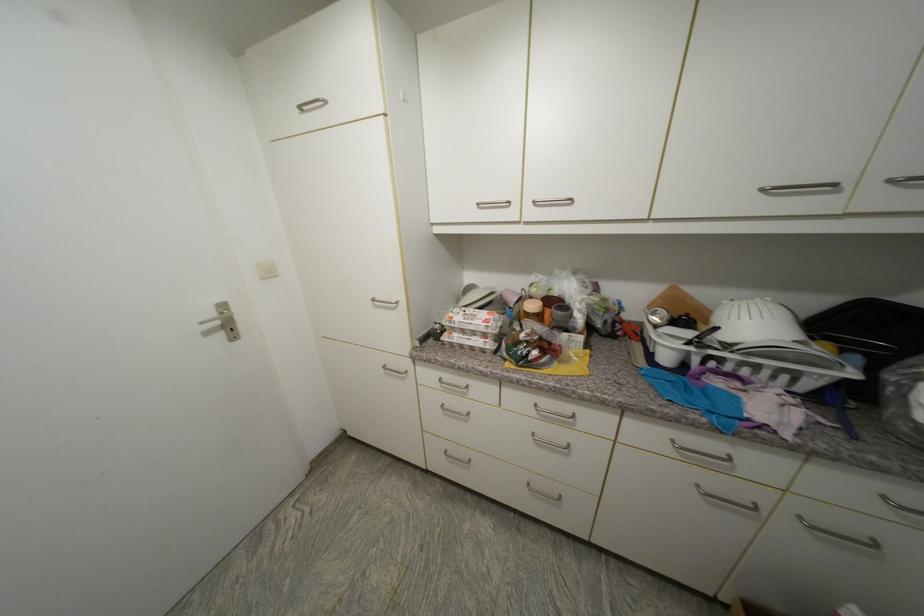
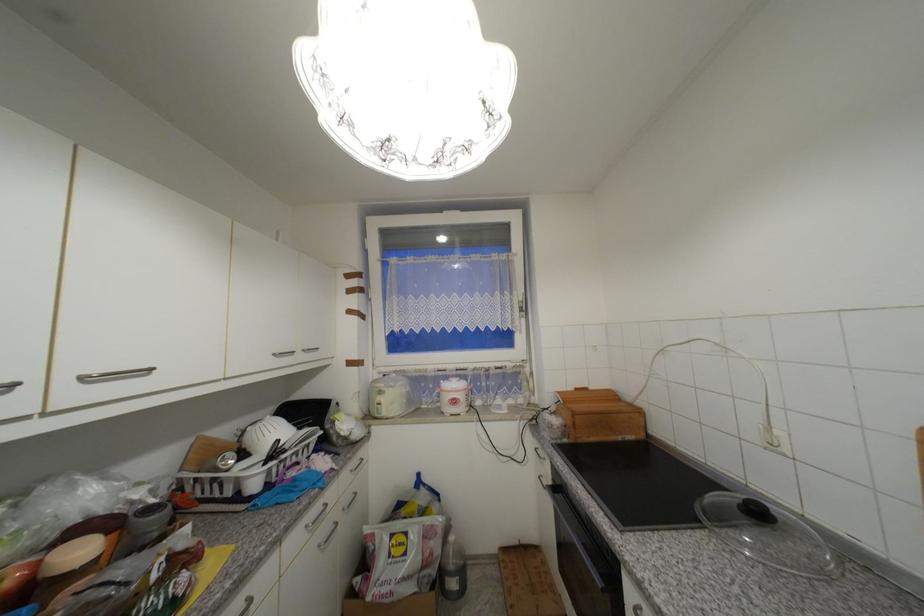
Find the pixel in the second image that matches point 768,191 in the first image.

(281, 355)